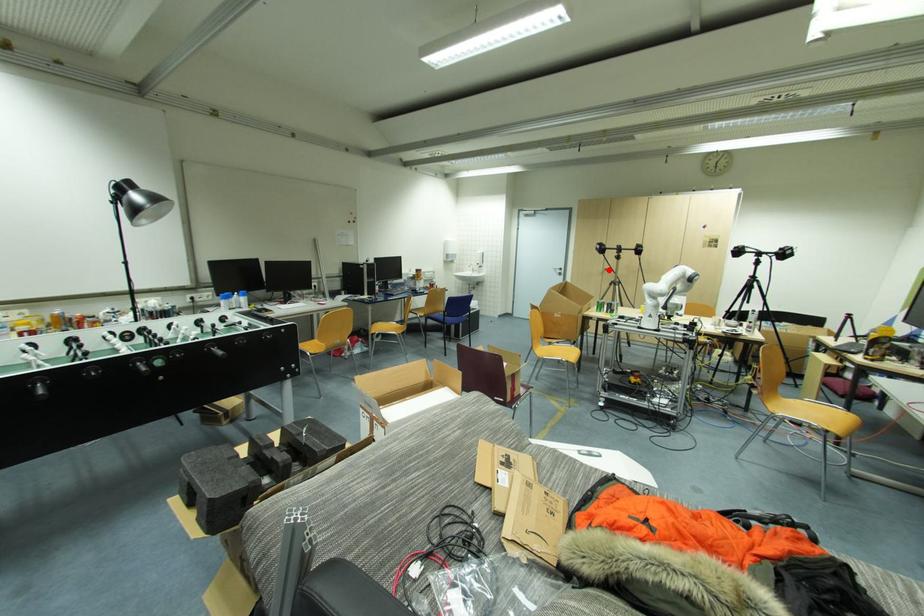
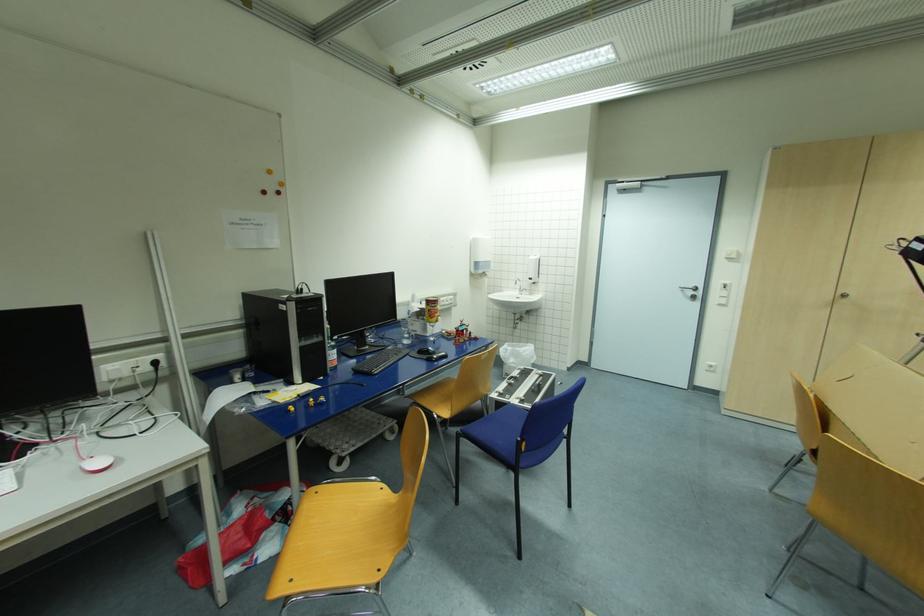
In the second image, find the point that corresponds to the highlighted location in the first image.

(847, 296)